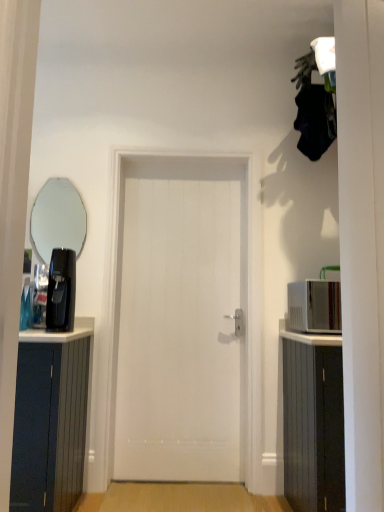
Locate an element on the screen. free region under white smooth door at center (from a real-world perspective) is located at coordinates (183, 483).